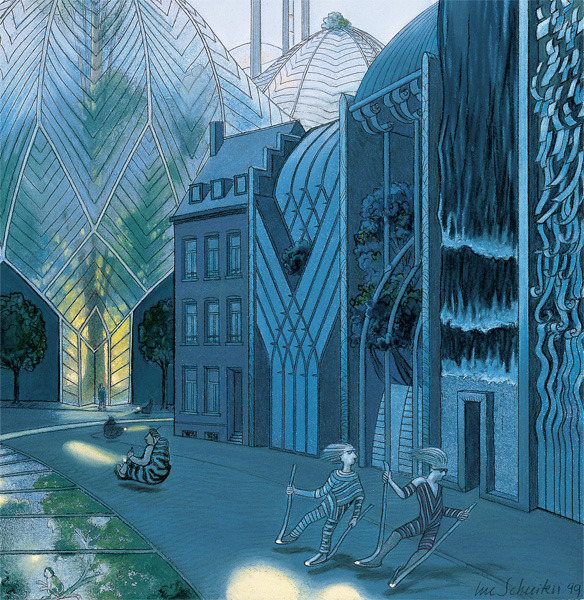
Where is `painting`? The image size is (584, 600). painting is located at coordinates (297, 293).